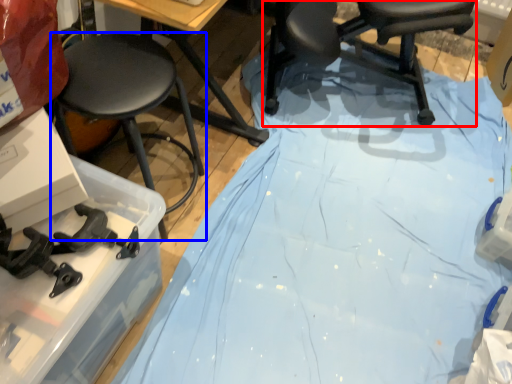
Question: Which object is further to the camera taking this photo, chair (highlighted by a red box) or stool (highlighted by a blue box)?

Choices:
 (A) chair
 (B) stool

Answer: (A)